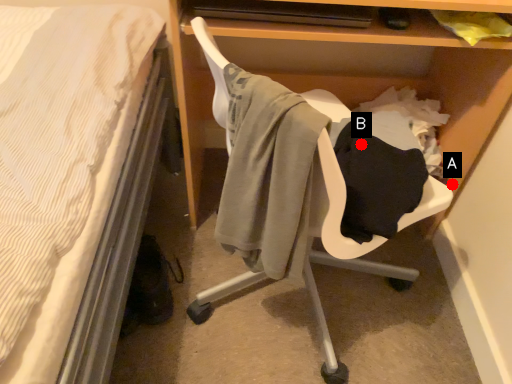
Question: Two points are circled on the image, labeled by A and B beside each circle. Which point is closer to the camera?

Choices:
 (A) A is closer
 (B) B is closer

Answer: (B)